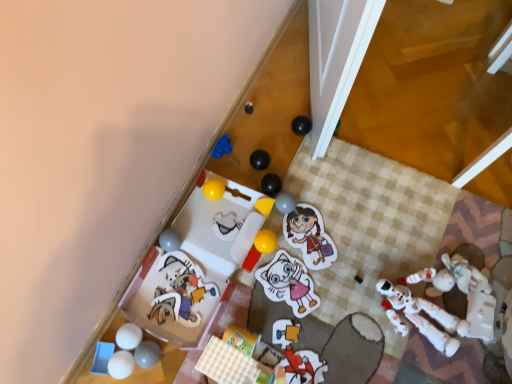
Find the location of a particular element. This screenshot has height=384, width=512. free area in between matte gray ball at lower left, acting as the fourth toy starting from the left, and white plastic toy at lower right, the fifteenth toy viewed from the left is located at coordinates (307, 326).